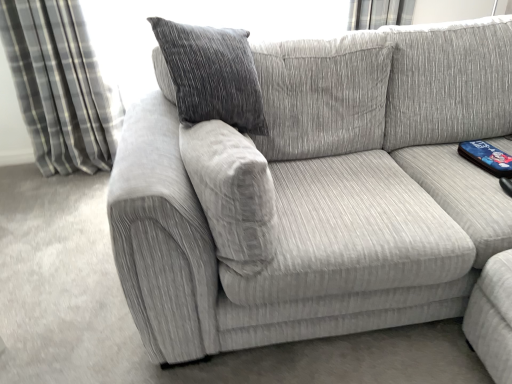
Question: From the image's perspective, is gray plaid curtain at left located above or below textured fabric couch at center?

Choices:
 (A) above
 (B) below

Answer: (A)

Question: Considering the positions of gray plaid curtain at left and textured fabric couch at center in the image, is gray plaid curtain at left bigger or smaller than textured fabric couch at center?

Choices:
 (A) small
 (B) big

Answer: (A)

Question: Is point (53, 92) positioned closer to the camera than point (352, 190)?

Choices:
 (A) farther
 (B) closer

Answer: (A)

Question: Considering the positions of textured fabric couch at center and gray plaid curtain at left in the image, is textured fabric couch at center taller or shorter than gray plaid curtain at left?

Choices:
 (A) tall
 (B) short

Answer: (B)

Question: From a real-world perspective, is textured fabric couch at center positioned above or below gray plaid curtain at left?

Choices:
 (A) above
 (B) below

Answer: (B)

Question: Is textured fabric couch at center wider or thinner than gray plaid curtain at left?

Choices:
 (A) thin
 (B) wide

Answer: (B)

Question: In terms of size, does textured fabric couch at center appear bigger or smaller than gray plaid curtain at left?

Choices:
 (A) small
 (B) big

Answer: (B)